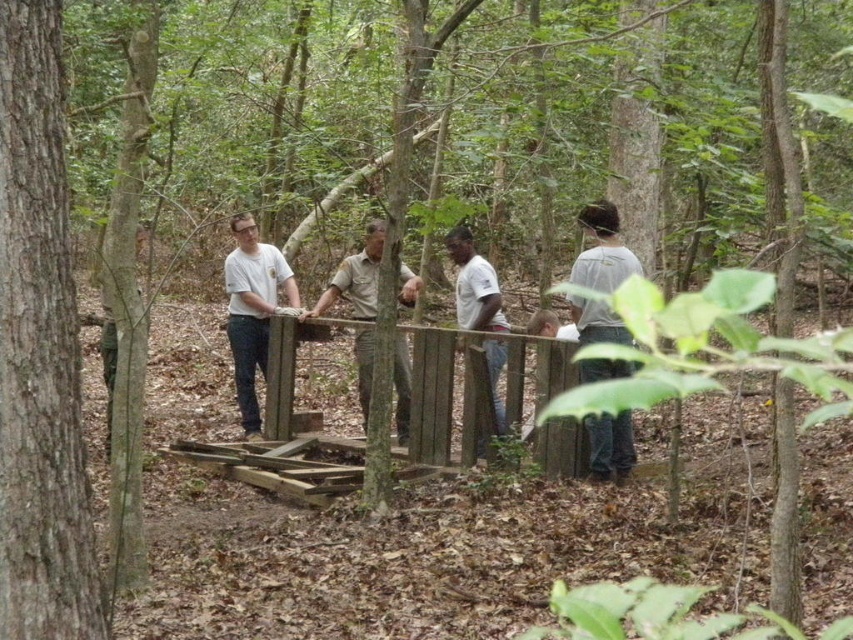
Question: Does smooth brown tree trunk at left lie in front of white cotton shirt at center?

Choices:
 (A) no
 (B) yes

Answer: (B)

Question: Which is farther from the white cotton shirt at center?

Choices:
 (A) smooth brown tree trunk at left
 (B) white matte shirt at center
 (C) brown uniform at center

Answer: (A)

Question: Based on their relative distances, which object is farther from the smooth brown tree trunk at left?

Choices:
 (A) gray cotton shirt at center
 (B) white cotton shirt at center
 (C) white matte shirt at center
 (D) brown uniform at center

Answer: (B)

Question: Is smooth brown tree trunk at left in front of gray cotton shirt at center?

Choices:
 (A) no
 (B) yes

Answer: (B)

Question: Which object is closer to the camera taking this photo?

Choices:
 (A) smooth brown tree trunk at left
 (B) white cotton shirt at center
 (C) brown uniform at center

Answer: (A)

Question: Is smooth brown tree trunk at left thinner than gray cotton shirt at center?

Choices:
 (A) yes
 (B) no

Answer: (A)